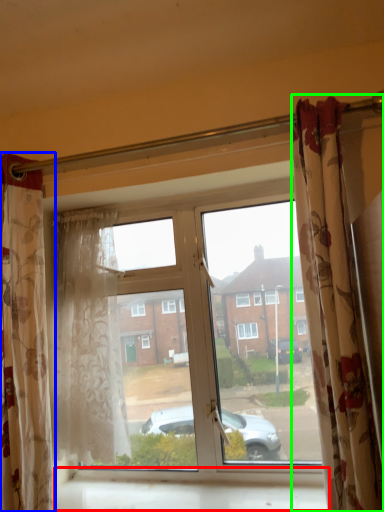
Question: Which object is positioned farthest from window sill (highlighted by a red box)? Select from curtain (highlighted by a blue box) and curtain (highlighted by a green box).

Choices:
 (A) curtain
 (B) curtain

Answer: (B)